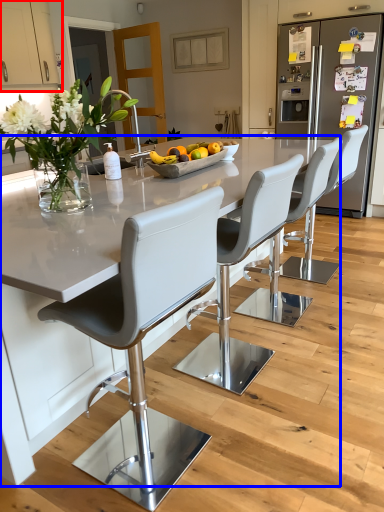
Question: Which object appears farthest to the camera in this image, cabinetry (highlighted by a red box) or kitchen & dining room table (highlighted by a blue box)?

Choices:
 (A) cabinetry
 (B) kitchen & dining room table

Answer: (A)